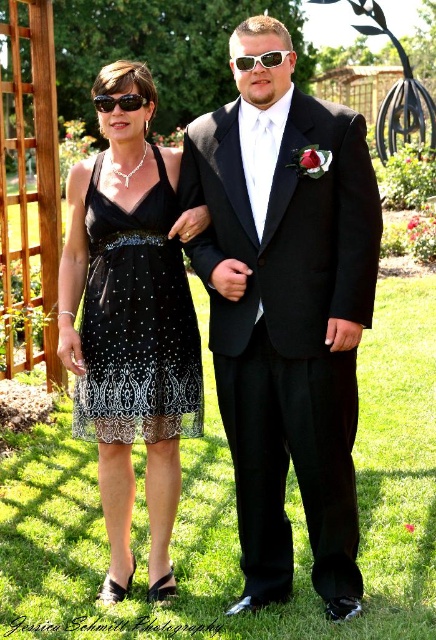
Question: Can you confirm if black lace dress at center is positioned above sunglasses at center?

Choices:
 (A) no
 (B) yes

Answer: (A)

Question: Which is nearer to the sunglasses at center?

Choices:
 (A) black lace dress at left
 (B) black lace dress at center
 (C) black plastic sunglasses at upper left

Answer: (C)

Question: Can you confirm if black satin suit at center is thinner than black lace dress at center?

Choices:
 (A) no
 (B) yes

Answer: (A)

Question: Which of the following is the farthest from the observer?

Choices:
 (A) black lace dress at left
 (B) sunglasses at center
 (C) black satin suit at center
 (D) green grass at center

Answer: (A)

Question: Which point appears farthest from the camera in this image?

Choices:
 (A) (265, 56)
 (B) (296, 93)

Answer: (B)

Question: Can you confirm if black satin suit at center is positioned above black lace dress at left?

Choices:
 (A) no
 (B) yes

Answer: (A)